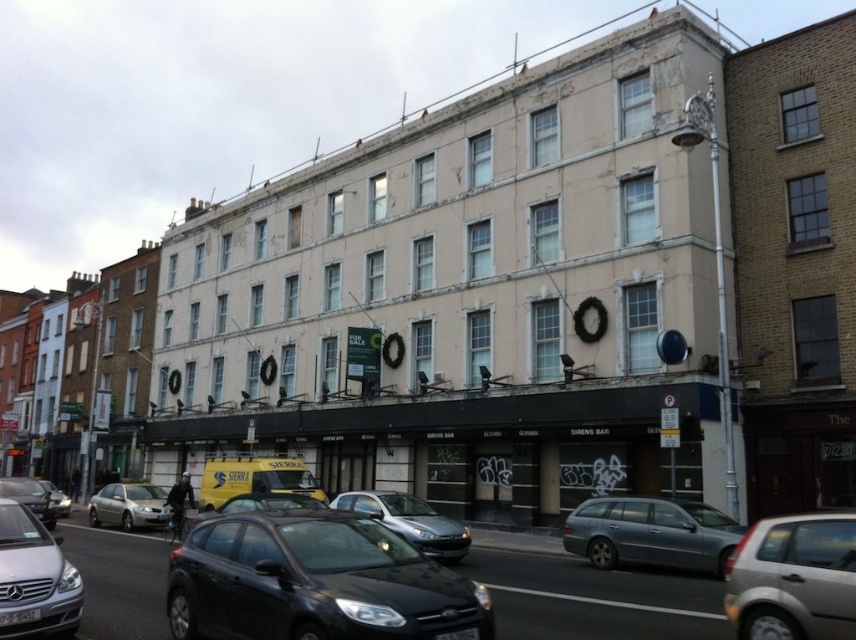
Question: Does black matte hatchback at center appear on the right side of silver metallic sedan at center?

Choices:
 (A) yes
 (B) no

Answer: (A)

Question: Considering the relative positions of silver metallic sedan at center and metallic silver car at lower left in the image provided, where is silver metallic sedan at center located with respect to metallic silver car at lower left?

Choices:
 (A) above
 (B) below

Answer: (A)

Question: Is silver metallic hatchback at lower right above satin silver car at center?

Choices:
 (A) yes
 (B) no

Answer: (A)

Question: Which object appears closest to the camera in this image?

Choices:
 (A) silver metallic car at lower left
 (B) metallic silver car at center

Answer: (A)

Question: Which object appears closest to the camera in this image?

Choices:
 (A) silver metallic car at lower left
 (B) yellow matte van at center

Answer: (A)

Question: Which object is closer to the camera taking this photo?

Choices:
 (A) brown brick building at upper right
 (B) shiny black sedan at center

Answer: (B)